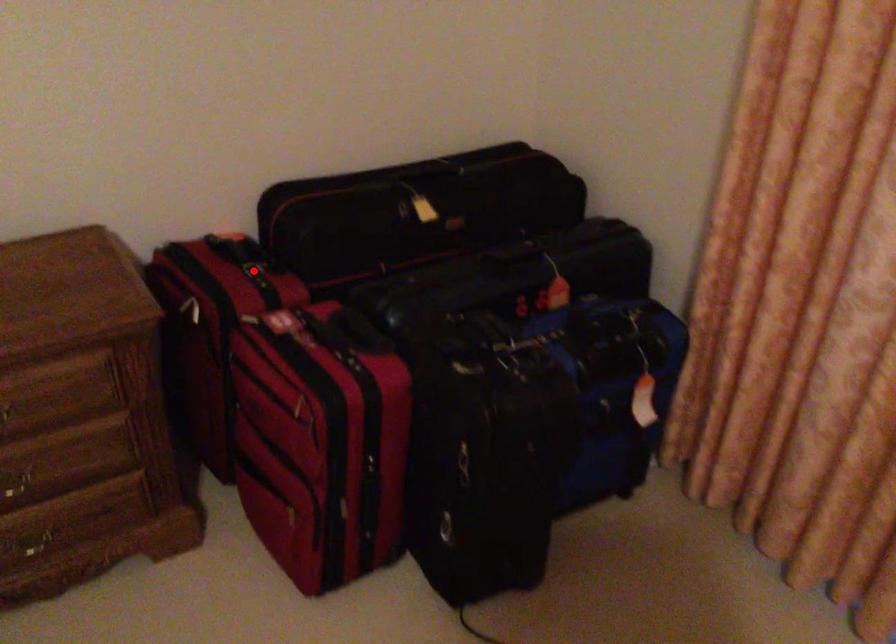
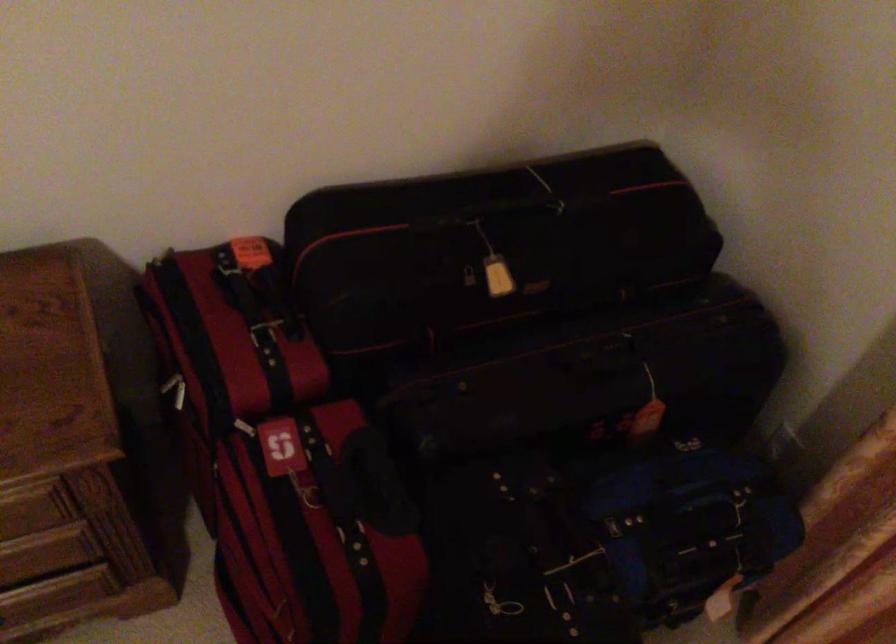
Question: I am providing you with two images of the same scene from different viewpoints. Image1 has a red point marked. In image2, the corresponding 3D location appears at what relative position? Reply with the corresponding letter.

Choices:
 (A) Closer
 (B) Farther

Answer: (A)